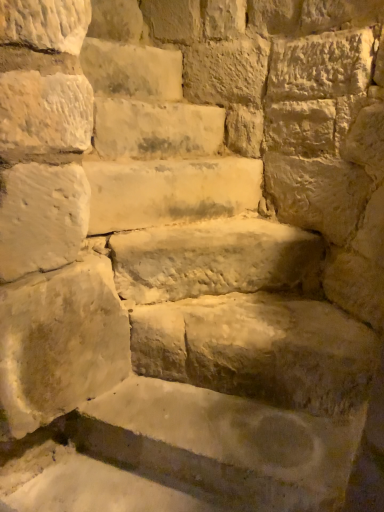
Describe the element at coordinates (169, 191) in the screenshot. I see `smooth stone step at center` at that location.

What is the approximate width of smooth stone step at center?

smooth stone step at center is 14.66 inches in width.

The width and height of the screenshot is (384, 512). Describe the element at coordinates (214, 259) in the screenshot. I see `smooth stone bench at center, the first brick positioned from the bottom` at that location.

The width and height of the screenshot is (384, 512). What are the coordinates of `white stone at center, acting as the third brick starting from the top` in the screenshot? It's located at (156, 129).

This screenshot has width=384, height=512. What do you see at coordinates (45, 24) in the screenshot? I see `smooth stone brick at upper left, arranged as the first brick when viewed from the top` at bounding box center [45, 24].

Find the location of a particular element. Image resolution: width=384 pixels, height=512 pixels. smooth stone brick at upper left, acting as the 3th brick starting from the bottom is located at coordinates (132, 70).

What do you see at coordinates (132, 70) in the screenshot? Image resolution: width=384 pixels, height=512 pixels. I see `smooth stone brick at upper left, which ranks as the 2th brick in top-to-bottom order` at bounding box center [132, 70].

Locate an element on the screen. This screenshot has height=512, width=384. smooth stone step at center is located at coordinates (169, 191).

Based on the photo, how different are the orientations of smooth stone brick at upper left, arranged as the first brick when viewed from the top, and smooth stone step at center in degrees?

The facing directions of smooth stone brick at upper left, arranged as the first brick when viewed from the top, and smooth stone step at center are 13.8 degrees apart.

Are smooth stone brick at upper left, arranged as the first brick when viewed from the top, and smooth stone step at center making contact?

There is a gap between smooth stone brick at upper left, arranged as the first brick when viewed from the top, and smooth stone step at center.

Is point (33, 13) less distant than point (116, 229)?

That is True.

Can you see smooth stone bench at center, the first brick positioned from the bottom, touching smooth stone brick at upper left, which ranks as the fourth brick in bottom-to-top order?

→ No, smooth stone bench at center, the first brick positioned from the bottom, is not in contact with smooth stone brick at upper left, which ranks as the fourth brick in bottom-to-top order.

Looking at this image, does smooth stone bench at center, the first brick positioned from the bottom, have a smaller size compared to smooth stone brick at upper left, which ranks as the fourth brick in bottom-to-top order?

No, smooth stone bench at center, the first brick positioned from the bottom, is not smaller than smooth stone brick at upper left, which ranks as the fourth brick in bottom-to-top order.

Locate an element on the screen. Image resolution: width=384 pixels, height=512 pixels. the 3rd brick located beneath the smooth stone brick at upper left, arranged as the first brick when viewed from the top (from a real-world perspective) is located at coordinates (214, 259).

Which is closer, (315, 251) or (49, 26)?

Point (315, 251) is farther from the camera than point (49, 26).

Which is more to the right, smooth stone brick at upper left, arranged as the first brick when viewed from the top, or smooth stone bench at center, which is counted as the fourth brick, starting from the top?

smooth stone bench at center, which is counted as the fourth brick, starting from the top, is more to the right.

Is smooth stone brick at upper left, which ranks as the fourth brick in bottom-to-top order, thinner than smooth stone bench at center, the first brick positioned from the bottom?

Indeed, smooth stone brick at upper left, which ranks as the fourth brick in bottom-to-top order, has a lesser width compared to smooth stone bench at center, the first brick positioned from the bottom.

Is smooth stone brick at upper left, which ranks as the fourth brick in bottom-to-top order, looking in the opposite direction of smooth stone bench at center, the first brick positioned from the bottom?

That's not correct — smooth stone brick at upper left, which ranks as the fourth brick in bottom-to-top order, is not looking away from smooth stone bench at center, the first brick positioned from the bottom.

From the image's perspective, is smooth stone brick at upper left, which ranks as the fourth brick in bottom-to-top order, above smooth stone bench at center, the first brick positioned from the bottom?

Yes.

Between smooth stone brick at upper left, which ranks as the fourth brick in bottom-to-top order, and white stone at center, acting as the third brick starting from the top, which one has less height?

white stone at center, acting as the third brick starting from the top.

Can you confirm if smooth stone brick at upper left, which ranks as the fourth brick in bottom-to-top order, is positioned to the left of white stone at center, acting as the third brick starting from the top?

Yes, smooth stone brick at upper left, which ranks as the fourth brick in bottom-to-top order, is to the left of white stone at center, acting as the third brick starting from the top.

Considering the points (66, 48) and (170, 125), which point is behind, point (66, 48) or point (170, 125)?

The point (170, 125) is farther from the camera.

Measure the distance between smooth stone brick at upper left, acting as the 3th brick starting from the bottom, and smooth stone brick at upper left, arranged as the first brick when viewed from the top.

A distance of 81.80 centimeters exists between smooth stone brick at upper left, acting as the 3th brick starting from the bottom, and smooth stone brick at upper left, arranged as the first brick when viewed from the top.

From the image's perspective, which brick is the 1st one below the smooth stone brick at upper left, which ranks as the fourth brick in bottom-to-top order? Please provide its 2D coordinates.

[(132, 70)]

From the picture: From a real-world perspective, which object rests below the other?

smooth stone brick at upper left, acting as the 3th brick starting from the bottom, from a real-world perspective.

Based on the photo, which is farther, (158,50) or (28,42)?

The point (158,50) is more distant.

Find the location of `the 2nd brick directly beneath the smooth stone brick at upper left, which ranks as the 2th brick in top-to-bottom order (from a real-world perspective)`. the 2nd brick directly beneath the smooth stone brick at upper left, which ranks as the 2th brick in top-to-bottom order (from a real-world perspective) is located at coordinates (214, 259).

Considering the sizes of smooth stone bench at center, the first brick positioned from the bottom, and smooth stone brick at upper left, which ranks as the 2th brick in top-to-bottom order, in the image, is smooth stone bench at center, the first brick positioned from the bottom, taller or shorter than smooth stone brick at upper left, which ranks as the 2th brick in top-to-bottom order,?

Clearly, smooth stone bench at center, the first brick positioned from the bottom, is shorter compared to smooth stone brick at upper left, which ranks as the 2th brick in top-to-bottom order.

From a real-world perspective, is smooth stone bench at center, the first brick positioned from the bottom, on top of smooth stone brick at upper left, which ranks as the 2th brick in top-to-bottom order?

Actually, smooth stone bench at center, the first brick positioned from the bottom, is physically below smooth stone brick at upper left, which ranks as the 2th brick in top-to-bottom order, in the real world.

Is smooth stone brick at upper left, which ranks as the fourth brick in bottom-to-top order, facing towards smooth stone brick at upper left, acting as the 3th brick starting from the bottom?

No, smooth stone brick at upper left, which ranks as the fourth brick in bottom-to-top order, is not turned towards smooth stone brick at upper left, acting as the 3th brick starting from the bottom.

Is point (19, 8) positioned behind point (169, 54)?

No, it is not.

Can you confirm if smooth stone brick at upper left, arranged as the first brick when viewed from the top, is positioned to the right of smooth stone brick at upper left, which ranks as the 2th brick in top-to-bottom order?

Incorrect, smooth stone brick at upper left, arranged as the first brick when viewed from the top, is not on the right side of smooth stone brick at upper left, which ranks as the 2th brick in top-to-bottom order.

In the image, is smooth stone brick at upper left, which ranks as the fourth brick in bottom-to-top order, positioned in front of or behind smooth stone brick at upper left, acting as the 3th brick starting from the bottom?

In the image, smooth stone brick at upper left, which ranks as the fourth brick in bottom-to-top order, appears behind smooth stone brick at upper left, acting as the 3th brick starting from the bottom.

I want to click on stone located on the right of smooth stone brick at upper left, arranged as the first brick when viewed from the top, so click(169, 191).

The image size is (384, 512). Identify the location of brick that is the 3rd one above the smooth stone bench at center, which is counted as the fourth brick, starting from the top (from a real-world perspective). (45, 24).

When comparing their distances from smooth stone step at center, does smooth stone brick at upper left, arranged as the first brick when viewed from the top, or smooth stone bench at center, the first brick positioned from the bottom, seem further?

smooth stone brick at upper left, arranged as the first brick when viewed from the top.

Based on the photo, which object lies nearer to the anchor point smooth stone bench at center, which is counted as the fourth brick, starting from the top, smooth stone brick at upper left, which ranks as the fourth brick in bottom-to-top order, or smooth stone brick at upper left, acting as the 3th brick starting from the bottom?

The object closer to smooth stone bench at center, which is counted as the fourth brick, starting from the top, is smooth stone brick at upper left, which ranks as the fourth brick in bottom-to-top order.

Based on their spatial positions, is white stone at center, which is the second brick from bottom to top, or smooth stone step at center further from smooth stone brick at upper left, acting as the 3th brick starting from the bottom?

smooth stone step at center is further to smooth stone brick at upper left, acting as the 3th brick starting from the bottom.

Based on their spatial positions, is smooth stone brick at upper left, acting as the 3th brick starting from the bottom, or white stone at center, which is the second brick from bottom to top, closer to smooth stone step at center?

Based on the image, white stone at center, which is the second brick from bottom to top, appears to be nearer to smooth stone step at center.

Looking at the image, which one is located closer to smooth stone brick at upper left, which ranks as the 2th brick in top-to-bottom order, smooth stone step at center or white stone at center, acting as the third brick starting from the top?

→ Based on the image, white stone at center, acting as the third brick starting from the top, appears to be nearer to smooth stone brick at upper left, which ranks as the 2th brick in top-to-bottom order.

From the image, which object appears to be nearer to smooth stone bench at center, the first brick positioned from the bottom, white stone at center, acting as the third brick starting from the top, or smooth stone brick at upper left, which ranks as the 2th brick in top-to-bottom order?

Among the two, white stone at center, acting as the third brick starting from the top, is located nearer to smooth stone bench at center, the first brick positioned from the bottom.

Which object lies nearer to the anchor point smooth stone brick at upper left, which ranks as the fourth brick in bottom-to-top order, smooth stone bench at center, the first brick positioned from the bottom, or white stone at center, which is the second brick from bottom to top?

The object closer to smooth stone brick at upper left, which ranks as the fourth brick in bottom-to-top order, is white stone at center, which is the second brick from bottom to top.

From the image, which object appears to be nearer to smooth stone brick at upper left, acting as the 3th brick starting from the bottom, smooth stone bench at center, which is counted as the fourth brick, starting from the top, or white stone at center, which is the second brick from bottom to top?

white stone at center, which is the second brick from bottom to top, is closer to smooth stone brick at upper left, acting as the 3th brick starting from the bottom.

This screenshot has height=512, width=384. Identify the location of brick between smooth stone brick at upper left, which ranks as the 2th brick in top-to-bottom order, and smooth stone bench at center, the first brick positioned from the bottom, from top to bottom. (156, 129).

The image size is (384, 512). In order to click on stone that lies between smooth stone brick at upper left, acting as the 3th brick starting from the bottom, and smooth stone bench at center, the first brick positioned from the bottom, from top to bottom in this screenshot , I will do `click(169, 191)`.

Where is `stone that lies between white stone at center, acting as the third brick starting from the top, and smooth stone bench at center, which is counted as the fourth brick, starting from the top, from top to bottom`? The width and height of the screenshot is (384, 512). stone that lies between white stone at center, acting as the third brick starting from the top, and smooth stone bench at center, which is counted as the fourth brick, starting from the top, from top to bottom is located at coordinates (169, 191).

Find the location of `brick that lies between smooth stone brick at upper left, acting as the 3th brick starting from the bottom, and smooth stone step at center from top to bottom`. brick that lies between smooth stone brick at upper left, acting as the 3th brick starting from the bottom, and smooth stone step at center from top to bottom is located at coordinates (156, 129).